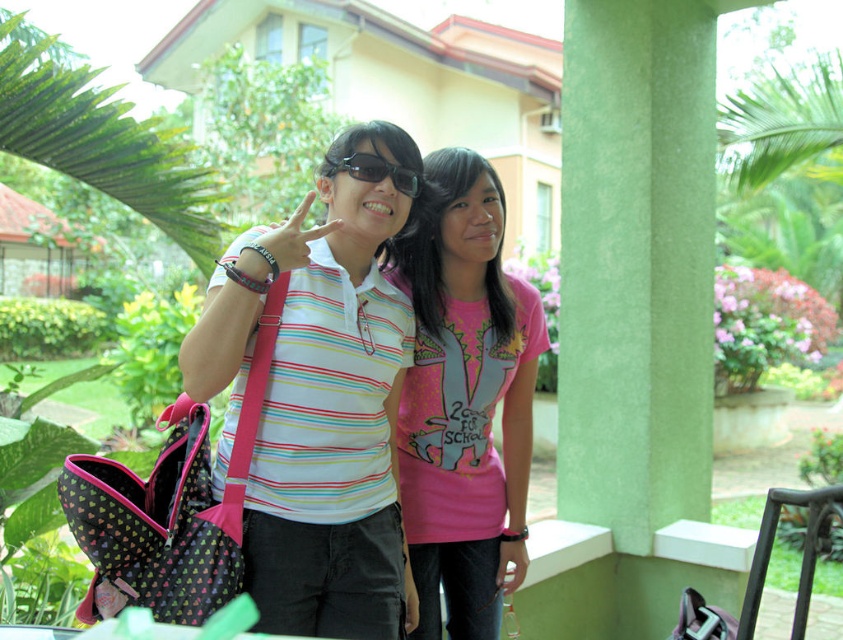
You are trying to decide which item to pack first in your bag. The striped cotton shirt at center and the matte black sunglasses at center are both on the table. Which item takes up more space?

The striped cotton shirt at center is bigger than matte black sunglasses at center, so the striped cotton shirt at center takes up more space.